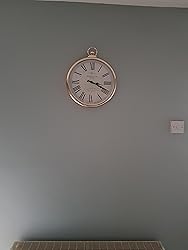
Find the location of a particular element. switch is located at coordinates (175, 127).